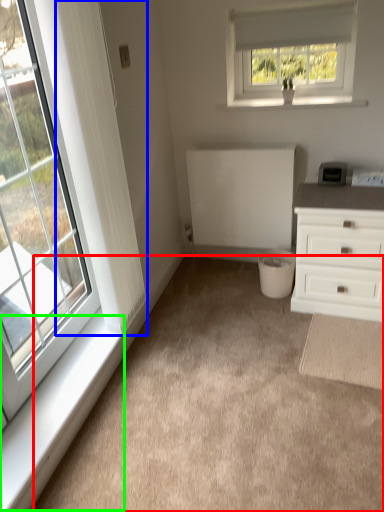
Question: Considering the real-world distances, which object is farthest from plain (highlighted by a red box)? curtain (highlighted by a blue box) or window sill (highlighted by a green box)?

Choices:
 (A) curtain
 (B) window sill

Answer: (A)